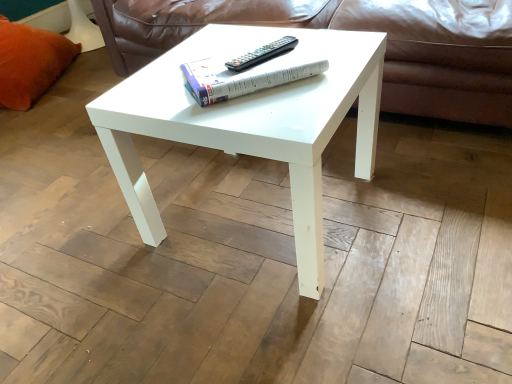
Image resolution: width=512 pixels, height=384 pixels. What are the coordinates of `free space behind white paper at center` in the screenshot? It's located at (226, 44).